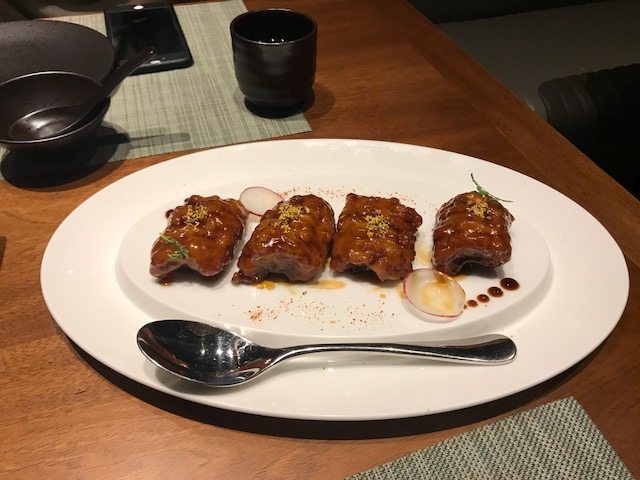
The height and width of the screenshot is (480, 640). I want to click on wooden table, so click(504, 44), click(593, 30), click(0, 399), click(108, 436), click(22, 235), click(620, 384), click(372, 51).